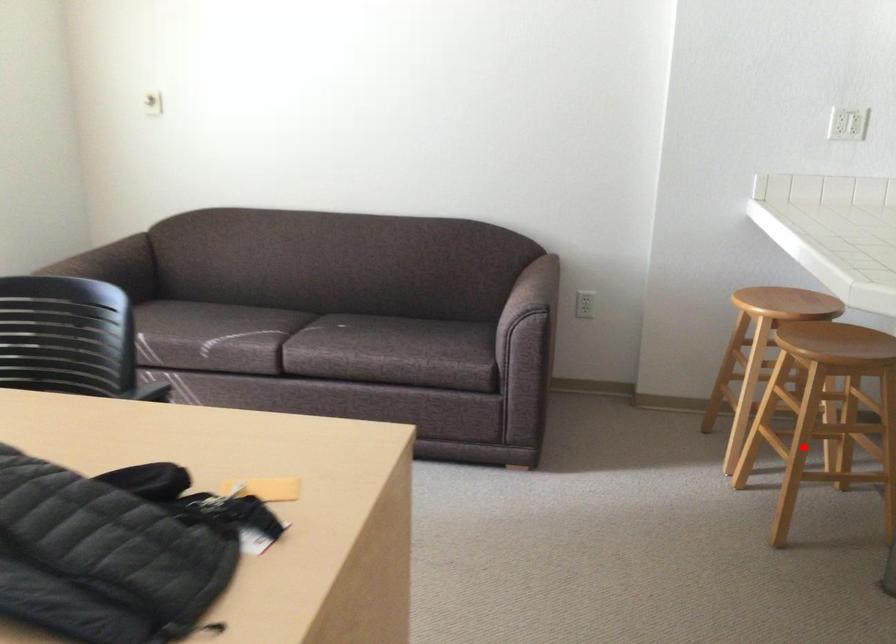
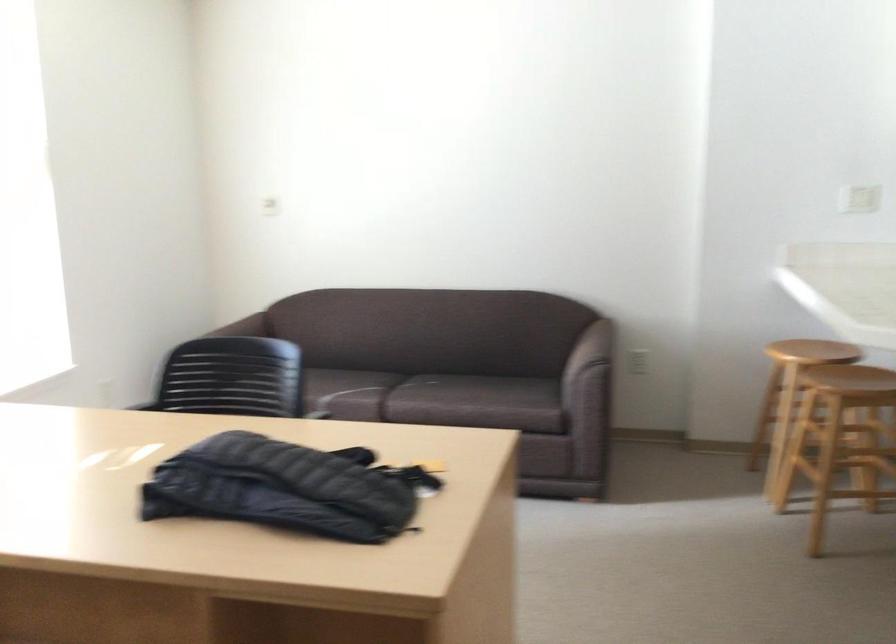
Question: I am providing you with two images of the same scene from different viewpoints. A red point is shown in image1. For the corresponding object point in image2, is it positioned nearer or farther from the camera?

Choices:
 (A) Nearer
 (B) Farther

Answer: (B)